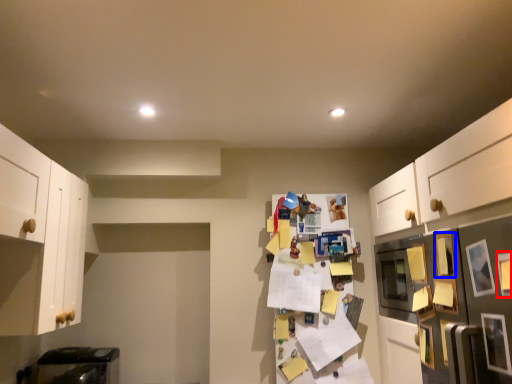
Question: Which object is further to the camera taking this photo, picture frame (highlighted by a red box) or picture frame (highlighted by a blue box)?

Choices:
 (A) picture frame
 (B) picture frame

Answer: (B)